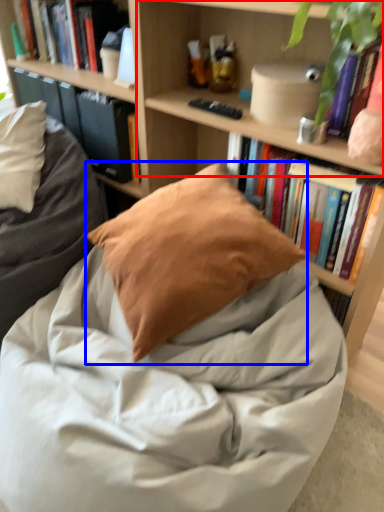
Question: Which object appears farthest to the camera in this image, shelf (highlighted by a red box) or pillow (highlighted by a blue box)?

Choices:
 (A) shelf
 (B) pillow

Answer: (B)